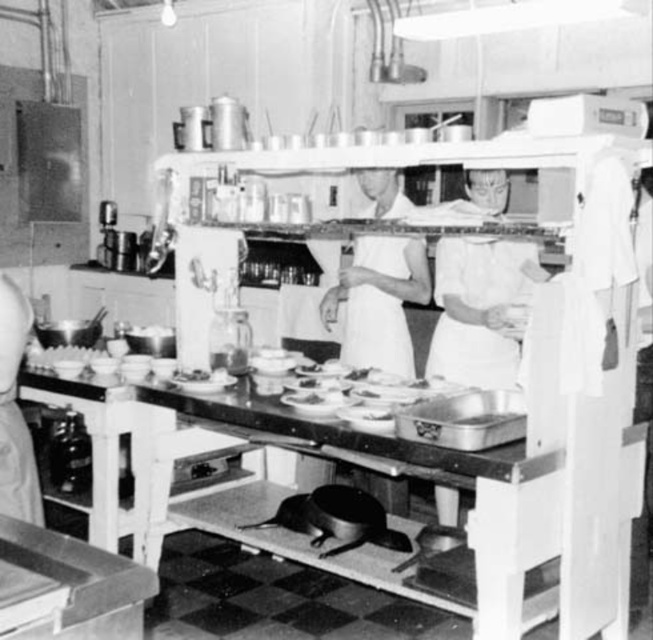
Question: Which point is farther from the camera taking this photo?

Choices:
 (A) (3, 387)
 (B) (413, 262)
 (C) (392, 320)

Answer: (C)

Question: Is the position of white cloth at center more distant than that of white fabric apron at center?

Choices:
 (A) no
 (B) yes

Answer: (A)

Question: Is white cloth at center in front of white fabric apron at center?

Choices:
 (A) yes
 (B) no

Answer: (A)

Question: Is white cloth at center above white fabric apron at center?

Choices:
 (A) no
 (B) yes

Answer: (B)

Question: Which of these objects is positioned farthest from the white fabric apron at left?

Choices:
 (A) white fabric apron at center
 (B) white cloth at center

Answer: (A)

Question: Which point is closer to the camera?

Choices:
 (A) white fabric apron at left
 (B) white cloth at center

Answer: (A)